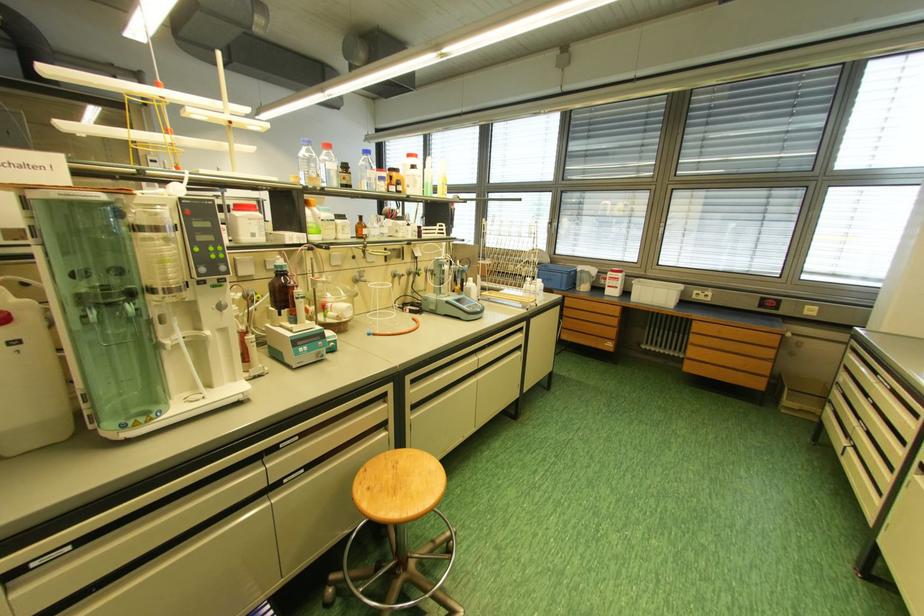
Find where to unscrew the bottle with red cap. Please return your answer as a coordinate pair (x, y).

(329, 166)